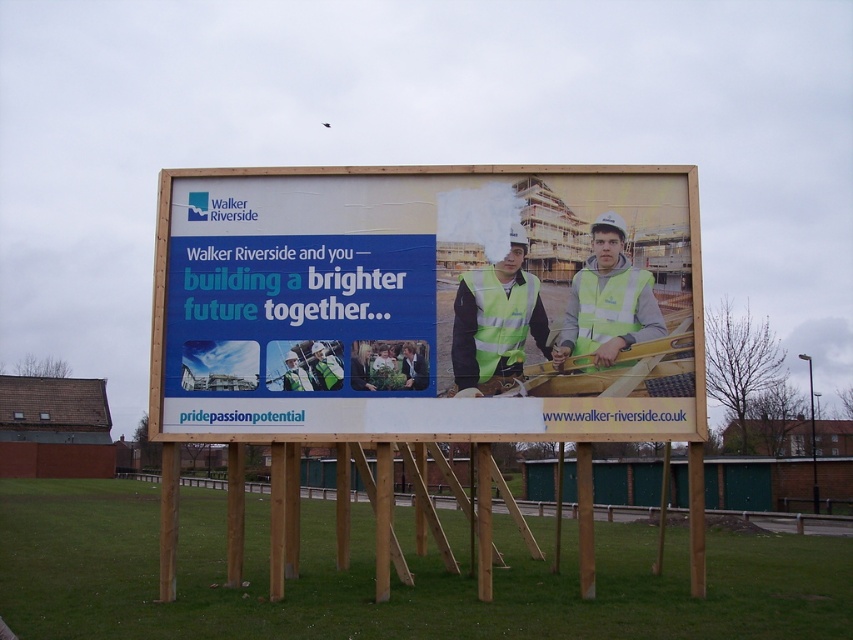
In the scene shown: Does matte yellow billboard at center have a lesser width compared to high visibility vest at center?

In fact, matte yellow billboard at center might be wider than high visibility vest at center.

Is matte yellow billboard at center smaller than high visibility vest at center?

Yes.

Does point (529, 355) come closer to viewer compared to point (521, 250)?

Yes, point (529, 355) is closer to viewer.

The height and width of the screenshot is (640, 853). I want to click on matte yellow billboard at center, so click(x=427, y=304).

Who is lower down, matte yellow billboard at center or high visibility yellow-green vest at center?

high visibility yellow-green vest at center

Is matte yellow billboard at center positioned behind high visibility yellow-green vest at center?

Yes, matte yellow billboard at center is behind high visibility yellow-green vest at center.

Describe the element at coordinates (427, 304) in the screenshot. The image size is (853, 640). I see `matte yellow billboard at center` at that location.

This screenshot has width=853, height=640. What are the coordinates of `matte yellow billboard at center` in the screenshot? It's located at (427, 304).

Measure the distance between point (454, 317) and camera.

The distance of point (454, 317) from camera is 12.72 meters.

Looking at this image, measure the distance between high visibility vest at center and high visibility yellow-green vest at center.

high visibility vest at center is 30.80 inches away from high visibility yellow-green vest at center.

Does point (473, 291) lie behind point (616, 285)?

No, (473, 291) is in front of (616, 285).

The height and width of the screenshot is (640, 853). I want to click on high visibility vest at center, so click(x=496, y=321).